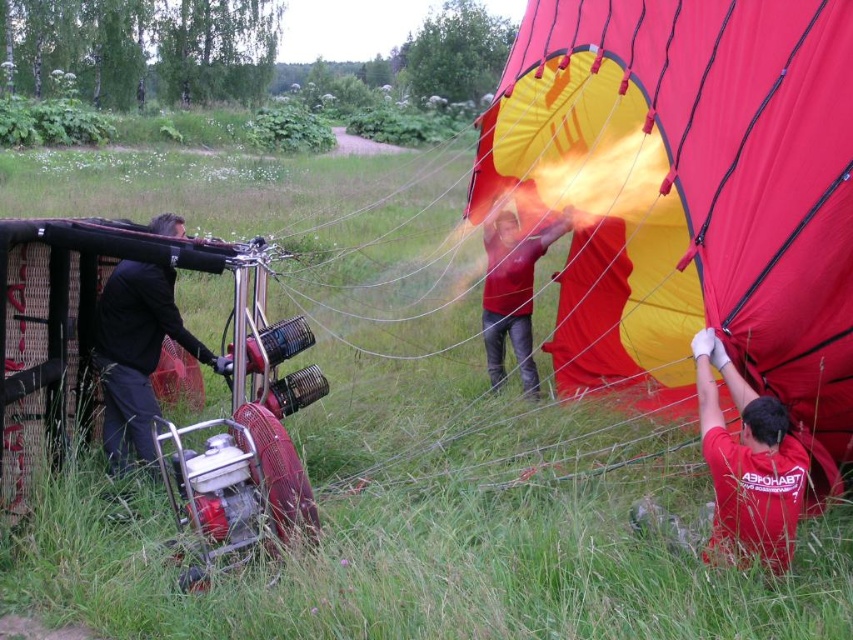
Question: Is red matte shirt at lower right above red matte shirt at center?

Choices:
 (A) yes
 (B) no

Answer: (B)

Question: Among these points, which one is nearest to the camera?

Choices:
 (A) (515, 282)
 (B) (125, 468)

Answer: (B)

Question: Which point is closer to the camera?

Choices:
 (A) (746, 369)
 (B) (498, 216)
 (C) (144, 365)
 (D) (669, 538)

Answer: (A)

Question: Does matte red parachute at center appear on the right side of red matte shirt at center?

Choices:
 (A) no
 (B) yes

Answer: (B)

Question: Observing the image, what is the correct spatial positioning of black matte jacket at left in reference to red matte shirt at center?

Choices:
 (A) left
 (B) right

Answer: (A)

Question: Among these points, which one is farthest from the camera?

Choices:
 (A) (550, 129)
 (B) (521, 259)
 (C) (660, 513)
 (D) (103, 316)

Answer: (A)